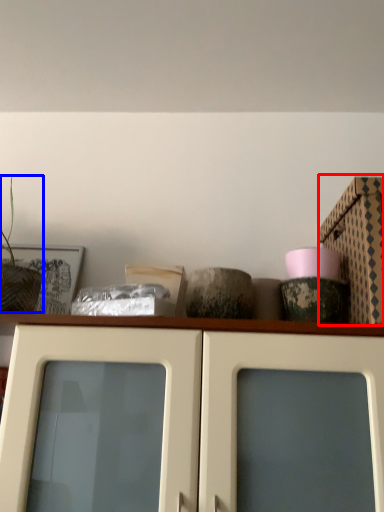
Question: Which object appears farthest to the camera in this image, cardboard box (highlighted by a red box) or plant (highlighted by a blue box)?

Choices:
 (A) cardboard box
 (B) plant

Answer: (A)